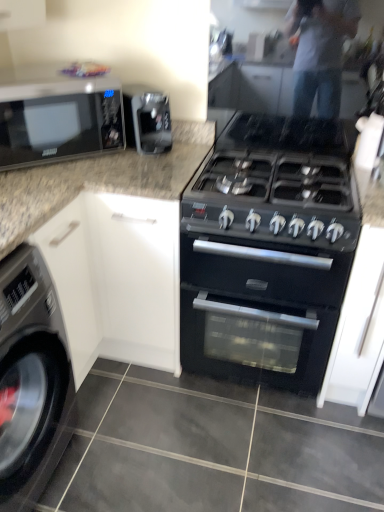
Question: From the image's perspective, is black glossy microwave at upper left over satin black coffee machine at upper center?

Choices:
 (A) no
 (B) yes

Answer: (A)

Question: Is satin black coffee machine at upper center at the back of black glossy microwave at upper left?

Choices:
 (A) no
 (B) yes

Answer: (A)

Question: Considering the relative sizes of black glossy microwave at upper left and satin black coffee machine at upper center in the image provided, is black glossy microwave at upper left bigger than satin black coffee machine at upper center?

Choices:
 (A) yes
 (B) no

Answer: (A)

Question: Would you consider black glossy microwave at upper left to be distant from satin black coffee machine at upper center?

Choices:
 (A) yes
 (B) no

Answer: (B)

Question: Could satin black coffee machine at upper center be considered to be inside black glossy microwave at upper left?

Choices:
 (A) no
 (B) yes

Answer: (A)

Question: Is satin black coffee machine at upper center spatially inside black glossy microwave at upper left, or outside of it?

Choices:
 (A) outside
 (B) inside

Answer: (A)

Question: In terms of width, does satin black coffee machine at upper center look wider or thinner when compared to black glossy microwave at upper left?

Choices:
 (A) thin
 (B) wide

Answer: (A)

Question: Does point (137, 104) appear closer or farther from the camera than point (6, 167)?

Choices:
 (A) closer
 (B) farther

Answer: (B)

Question: Considering the positions of satin black coffee machine at upper center and black glossy microwave at upper left in the image, is satin black coffee machine at upper center bigger or smaller than black glossy microwave at upper left?

Choices:
 (A) small
 (B) big

Answer: (A)

Question: Is black matte oven at center taller or shorter than black matte gas stove at center?

Choices:
 (A) short
 (B) tall

Answer: (B)

Question: Do you think black matte oven at center is within black matte gas stove at center, or outside of it?

Choices:
 (A) inside
 (B) outside

Answer: (B)

Question: In terms of width, does black matte oven at center look wider or thinner when compared to black matte gas stove at center?

Choices:
 (A) wide
 (B) thin

Answer: (A)

Question: From the image's perspective, relative to black matte gas stove at center, is black matte oven at center above or below?

Choices:
 (A) above
 (B) below

Answer: (B)

Question: Considering their positions, is black matte oven at center located in front of or behind black glossy microwave at upper left?

Choices:
 (A) front
 (B) behind

Answer: (A)

Question: Visually, is black matte oven at center positioned to the left or to the right of black glossy microwave at upper left?

Choices:
 (A) right
 (B) left

Answer: (A)